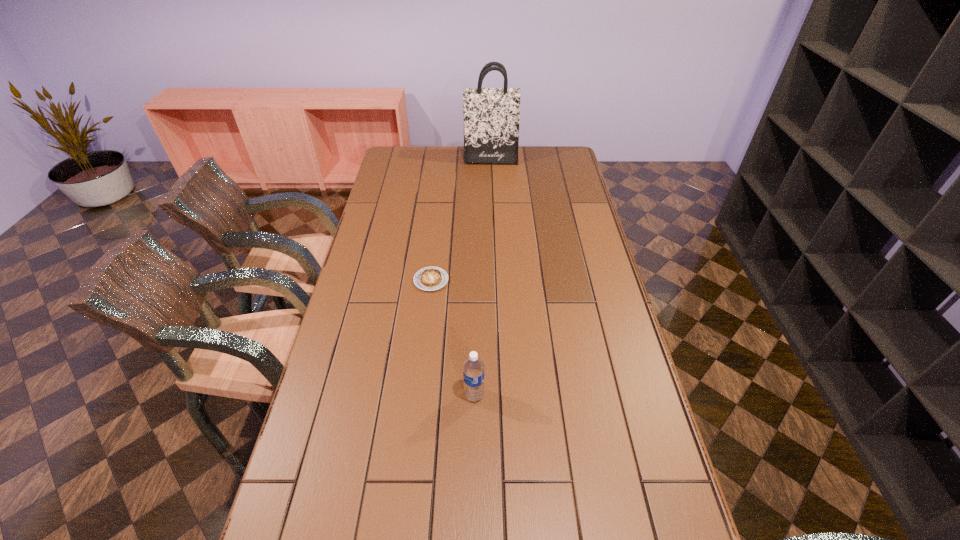
Locate an element on the screen. Image resolution: width=960 pixels, height=540 pixels. the tallest object is located at coordinates (491, 115).

Identify the location of shopping bag. The image size is (960, 540). (491, 115).

At what (x,y) coordinates should I click in order to perform the action: click on the nearest object. Please return your answer as a coordinate pair (x, y). Looking at the image, I should click on (473, 368).

The width and height of the screenshot is (960, 540). Identify the location of the second tallest object. (473, 368).

At what (x,y) coordinates should I click in order to perform the action: click on the leftmost object. Please return your answer as a coordinate pair (x, y). This screenshot has width=960, height=540. Looking at the image, I should click on (429, 278).

The image size is (960, 540). Identify the location of quiche. (429, 278).

Find the location of a particular element. free region located on the front of the tallest object with the design is located at coordinates (491, 172).

Where is `free spot located 0.210m on the left of the second shortest object`? The height and width of the screenshot is (540, 960). free spot located 0.210m on the left of the second shortest object is located at coordinates (387, 395).

I want to click on vacant area situated on the left of the shortest object, so click(x=379, y=280).

I want to click on object situated at the far edge, so click(491, 115).